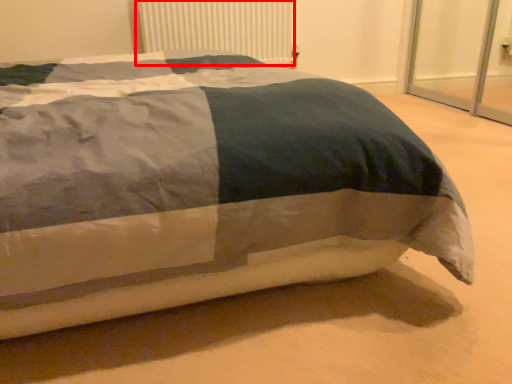
Question: From the image's perspective, where is radiator (annotated by the red box) located relative to bed?

Choices:
 (A) above
 (B) below

Answer: (A)